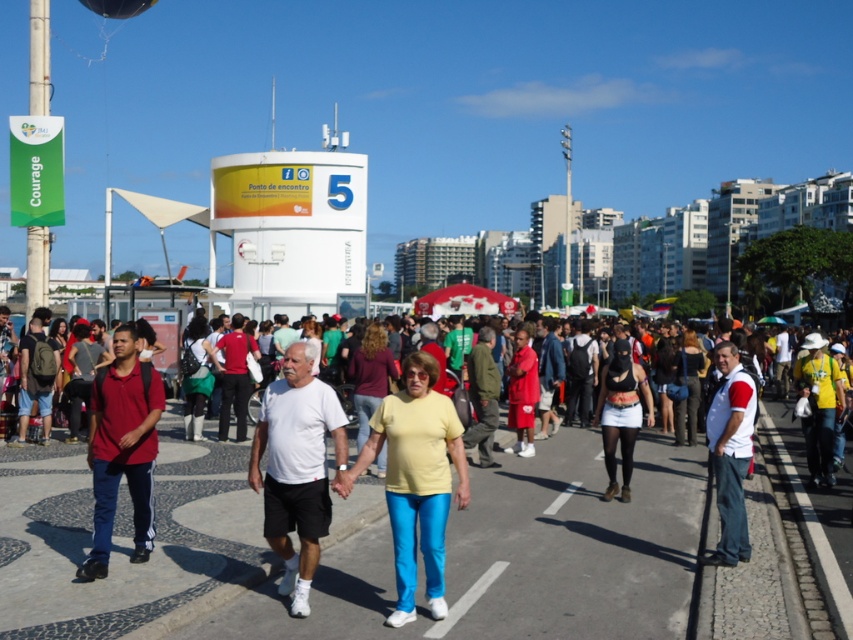
Between point (306, 260) and point (809, 436), which one is positioned behind?

Point (306, 260)

Is white matte water tower at center above yellow fabric shirt at center?

Indeed, white matte water tower at center is positioned over yellow fabric shirt at center.

Does point (321, 188) lie in front of point (825, 371)?

No, (321, 188) is further to viewer.

Where is `white matte water tower at center`? white matte water tower at center is located at coordinates (292, 228).

Is yellow fabric shirt at center positioned before transparent plastic balloon at upper left?

Yes, it is in front of transparent plastic balloon at upper left.

I want to click on yellow fabric shirt at center, so click(x=817, y=406).

Is point (816, 362) farther from camera compared to point (111, 17)?

No, (816, 362) is closer to viewer.

Find the location of a particular element. yellow fabric shirt at center is located at coordinates [817, 406].

Which is behind, point (410, 509) or point (144, 449)?

Point (144, 449)

Can you confirm if yellow matte shirt at center is wider than matte red shirt at left?

Yes.

Is point (438, 412) positioned in front of point (96, 557)?

Yes, point (438, 412) is in front of point (96, 557).

You are a GUI agent. You are given a task and a screenshot of the screen. Output one action in this format:
    pyautogui.click(x=<x>, y=<y>)
    Task: Click on the yellow matte shirt at center
    The height and width of the screenshot is (640, 853).
    Given the screenshot: What is the action you would take?
    pyautogui.click(x=416, y=480)